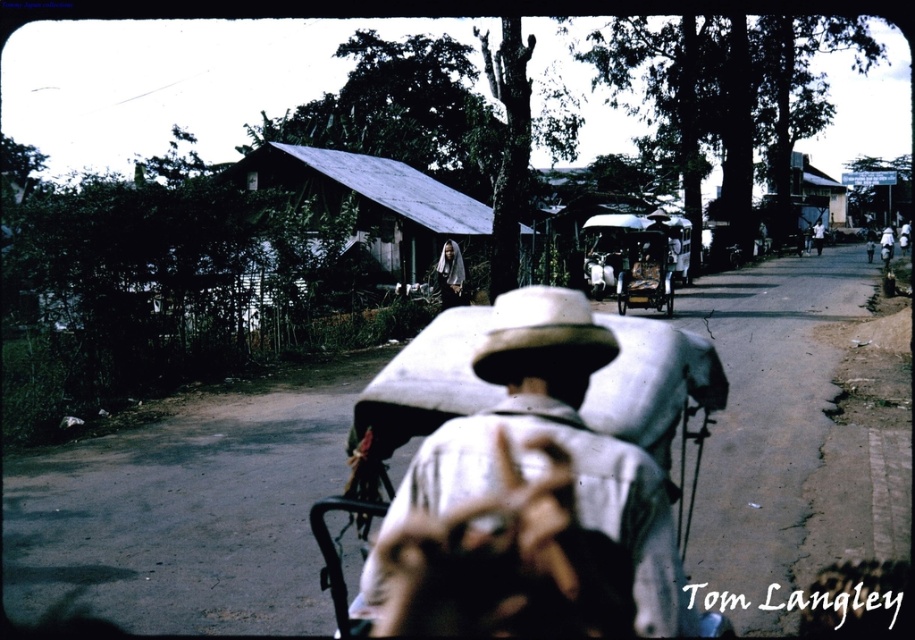
Does point (397, 196) come behind point (461, 301)?

That is True.

Who is positioned more to the left, metallic corrugated roof at center or white cloth headscarf at center?

metallic corrugated roof at center is more to the left.

Is point (468, 252) behind point (459, 296)?

That is True.

The image size is (915, 640). Identify the location of metallic corrugated roof at center. (372, 202).

Between white matte hat at center and metallic corrugated roof at center, which one has more height?

metallic corrugated roof at center is taller.

Can you confirm if white matte hat at center is positioned below metallic corrugated roof at center?

Indeed, white matte hat at center is positioned under metallic corrugated roof at center.

Does point (636, 570) come behind point (302, 157)?

No, it is in front of (302, 157).

You are a GUI agent. You are given a task and a screenshot of the screen. Output one action in this format:
    pyautogui.click(x=<x>, y=<y>)
    Task: Click on the white matte hat at center
    
    Given the screenshot: What is the action you would take?
    pyautogui.click(x=558, y=442)

The width and height of the screenshot is (915, 640). What do you see at coordinates (372, 202) in the screenshot?
I see `metallic corrugated roof at center` at bounding box center [372, 202].

Measure the distance between point (425, 188) and camera.

31.86 meters

Identify the location of metallic corrugated roof at center. (372, 202).

Where is `metallic corrugated roof at center`? This screenshot has width=915, height=640. metallic corrugated roof at center is located at coordinates (372, 202).